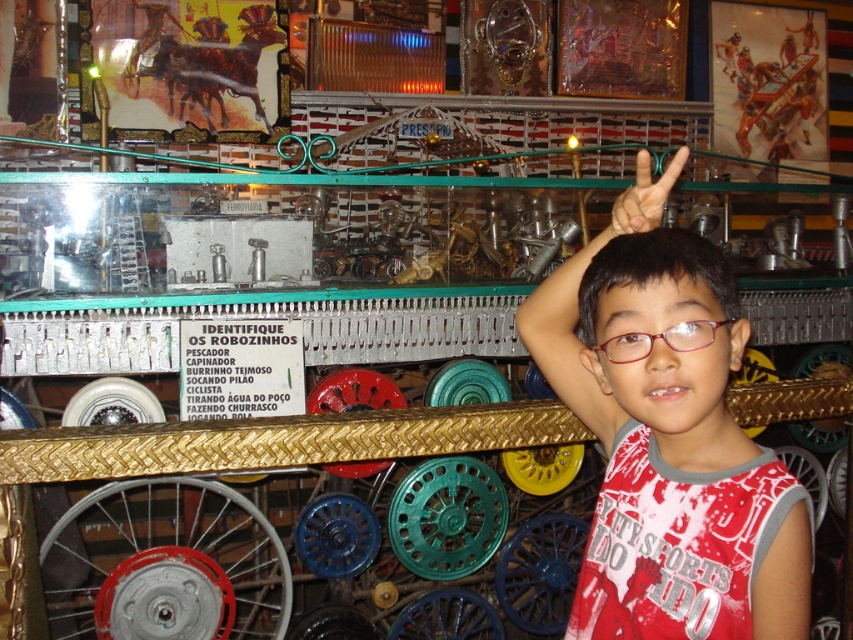
Question: Does white cotton shirt at upper right have a larger size compared to white matte hand at upper right?

Choices:
 (A) no
 (B) yes

Answer: (B)

Question: Which of the following is the closest to the observer?

Choices:
 (A) (544, 291)
 (B) (665, 180)

Answer: (B)

Question: Considering the relative positions of white cotton shirt at upper right and white matte hand at upper right in the image provided, where is white cotton shirt at upper right located with respect to white matte hand at upper right?

Choices:
 (A) above
 (B) below

Answer: (B)

Question: Does white cotton shirt at upper right have a larger size compared to clear plastic glasses at upper right?

Choices:
 (A) yes
 (B) no

Answer: (A)

Question: Which object is closer to the camera taking this photo?

Choices:
 (A) white cotton shirt at upper right
 (B) clear plastic glasses at upper right
 (C) white matte hand at upper right

Answer: (A)

Question: Which object is closer to the camera taking this photo?

Choices:
 (A) white matte hand at upper right
 (B) white cotton shirt at upper right

Answer: (B)